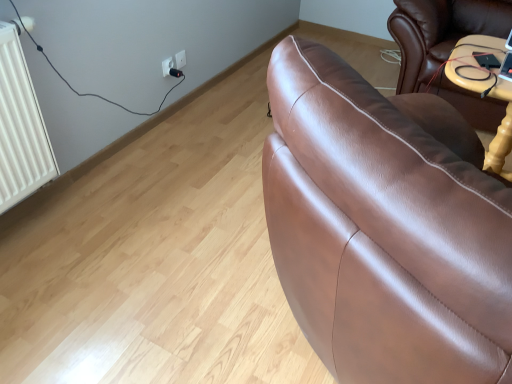
Measure the distance between point (170, 69) and camera.

They are 2.27 meters apart.

What do you see at coordinates (180, 59) in the screenshot? I see `white plastic socket at upper left, acting as the 1th electric outlet starting from the right` at bounding box center [180, 59].

Locate an element on the screen. Image resolution: width=512 pixels, height=384 pixels. white plastic socket at upper center, the second electric outlet when ordered from right to left is located at coordinates (167, 66).

Who is more distant, white plastic socket at upper center, which is the 1th electric outlet from left to right, or black plastic plug at upper center?

black plastic plug at upper center is further away from the camera.

From a real-world perspective, between white plastic socket at upper center, the second electric outlet when ordered from right to left, and black plastic plug at upper center, who is vertically higher?

From a 3D spatial view, white plastic socket at upper center, the second electric outlet when ordered from right to left, is above.

How different are the orientations of white plastic socket at upper center, which is the 1th electric outlet from left to right, and black plastic plug at upper center in degrees?

There is a 6.99-degree angle between the facing directions of white plastic socket at upper center, which is the 1th electric outlet from left to right, and black plastic plug at upper center.

From the image's perspective, which one is positioned higher, white plastic socket at upper center, the second electric outlet when ordered from right to left, or black plastic plug at upper center?

white plastic socket at upper center, the second electric outlet when ordered from right to left.

Is white plastic socket at upper center, which is the 1th electric outlet from left to right, oriented away from white plastic socket at upper left, acting as the 1th electric outlet starting from the right?

white plastic socket at upper center, which is the 1th electric outlet from left to right, does not have its back to white plastic socket at upper left, acting as the 1th electric outlet starting from the right.

Is the surface of white plastic socket at upper center, which is the 1th electric outlet from left to right, in direct contact with white plastic socket at upper left, the second electric outlet positioned from the left?

Yes, the surface of white plastic socket at upper center, which is the 1th electric outlet from left to right, is in contact with white plastic socket at upper left, the second electric outlet positioned from the left.

From the image's perspective, is white plastic socket at upper center, the second electric outlet when ordered from right to left, positioned above or below white plastic socket at upper left, the second electric outlet positioned from the left?

From the image's perspective, white plastic socket at upper center, the second electric outlet when ordered from right to left, appears below white plastic socket at upper left, the second electric outlet positioned from the left.

Considering the positions of objects white plastic socket at upper center, which is the 1th electric outlet from left to right, and white plastic socket at upper left, the second electric outlet positioned from the left, in the image provided, who is more to the right, white plastic socket at upper center, which is the 1th electric outlet from left to right, or white plastic socket at upper left, the second electric outlet positioned from the left,?

From the viewer's perspective, white plastic socket at upper left, the second electric outlet positioned from the left, appears more on the right side.

Is there a large distance between black plastic plug at upper center and white plastic socket at upper left, the second electric outlet positioned from the left?

No.

The width and height of the screenshot is (512, 384). In order to click on the 2nd electric outlet directly above the black plastic plug at upper center (from a real-world perspective) in this screenshot , I will do (180, 59).

Based on the photo, who is smaller, black plastic plug at upper center or white plastic socket at upper left, acting as the 1th electric outlet starting from the right?

white plastic socket at upper left, acting as the 1th electric outlet starting from the right.

Which point is more forward, (173, 68) or (184, 50)?

The point (173, 68) is in front.

Is white plastic socket at upper center, the second electric outlet when ordered from right to left, surrounded by white plastic socket at upper left, acting as the 1th electric outlet starting from the right?

No, white plastic socket at upper center, the second electric outlet when ordered from right to left, is not a part of white plastic socket at upper left, acting as the 1th electric outlet starting from the right.

Is white plastic socket at upper left, acting as the 1th electric outlet starting from the right, in front of or behind white plastic socket at upper center, the second electric outlet when ordered from right to left, in the image?

white plastic socket at upper left, acting as the 1th electric outlet starting from the right, is positioned farther from the viewer than white plastic socket at upper center, the second electric outlet when ordered from right to left.

Is black plastic plug at upper center spatially inside white plastic socket at upper center, which is the 1th electric outlet from left to right, or outside of it?

black plastic plug at upper center can be found inside white plastic socket at upper center, which is the 1th electric outlet from left to right.

Which object is thinner, black plastic plug at upper center or white plastic socket at upper center, which is the 1th electric outlet from left to right?

white plastic socket at upper center, which is the 1th electric outlet from left to right, is thinner.

Is black plastic plug at upper center aimed at white plastic socket at upper center, the second electric outlet when ordered from right to left?

No, black plastic plug at upper center is not turned towards white plastic socket at upper center, the second electric outlet when ordered from right to left.

Considering the sizes of white plastic socket at upper left, acting as the 1th electric outlet starting from the right, and black plastic plug at upper center in the image, is white plastic socket at upper left, acting as the 1th electric outlet starting from the right, wider or thinner than black plastic plug at upper center?

Clearly, white plastic socket at upper left, acting as the 1th electric outlet starting from the right, has less width compared to black plastic plug at upper center.

Looking at this image, does white plastic socket at upper left, the second electric outlet positioned from the left, appear on the right side of black plastic plug at upper center?

Correct, you'll find white plastic socket at upper left, the second electric outlet positioned from the left, to the right of black plastic plug at upper center.

Image resolution: width=512 pixels, height=384 pixels. In the image, there is a white plastic socket at upper left, acting as the 1th electric outlet starting from the right. In order to click on plug below it (from a real-world perspective) in this screenshot , I will do `click(176, 73)`.

Can we say white plastic socket at upper left, acting as the 1th electric outlet starting from the right, lies outside black plastic plug at upper center?

Yes, white plastic socket at upper left, acting as the 1th electric outlet starting from the right, is not within black plastic plug at upper center.

Where is `plug that appears behind the white plastic socket at upper center, which is the 1th electric outlet from left to right`? The image size is (512, 384). plug that appears behind the white plastic socket at upper center, which is the 1th electric outlet from left to right is located at coordinates (x=176, y=73).

Identify the location of electric outlet located above the white plastic socket at upper center, which is the 1th electric outlet from left to right (from the image's perspective). This screenshot has height=384, width=512. (180, 59).

Based on their spatial positions, is white plastic socket at upper center, which is the 1th electric outlet from left to right, or black plastic plug at upper center closer to white plastic socket at upper left, the second electric outlet positioned from the left?

black plastic plug at upper center is positioned closer to the anchor white plastic socket at upper left, the second electric outlet positioned from the left.

In the scene shown: Looking at the image, which one is located further to black plastic plug at upper center, white plastic socket at upper center, which is the 1th electric outlet from left to right, or white plastic socket at upper left, the second electric outlet positioned from the left?

The object further to black plastic plug at upper center is white plastic socket at upper center, which is the 1th electric outlet from left to right.

Considering their positions, is black plastic plug at upper center positioned closer to white plastic socket at upper left, acting as the 1th electric outlet starting from the right, than white plastic socket at upper center, which is the 1th electric outlet from left to right?

black plastic plug at upper center is positioned closer to the anchor white plastic socket at upper left, acting as the 1th electric outlet starting from the right.

Looking at the image, which one is located further to black plastic plug at upper center, white plastic socket at upper left, acting as the 1th electric outlet starting from the right, or white plastic socket at upper center, which is the 1th electric outlet from left to right?

white plastic socket at upper center, which is the 1th electric outlet from left to right, is positioned further to the anchor black plastic plug at upper center.

Looking at the image, which one is located closer to white plastic socket at upper center, which is the 1th electric outlet from left to right, white plastic socket at upper left, acting as the 1th electric outlet starting from the right, or black plastic plug at upper center?

black plastic plug at upper center is positioned closer to the anchor white plastic socket at upper center, which is the 1th electric outlet from left to right.

Which object lies nearer to the anchor point white plastic socket at upper center, which is the 1th electric outlet from left to right, black plastic plug at upper center or white plastic socket at upper left, the second electric outlet positioned from the left?

black plastic plug at upper center lies closer to white plastic socket at upper center, which is the 1th electric outlet from left to right, than the other object.

The width and height of the screenshot is (512, 384). Find the location of `electric outlet between white plastic socket at upper left, the second electric outlet positioned from the left, and black plastic plug at upper center, in the vertical direction`. electric outlet between white plastic socket at upper left, the second electric outlet positioned from the left, and black plastic plug at upper center, in the vertical direction is located at coordinates (167, 66).